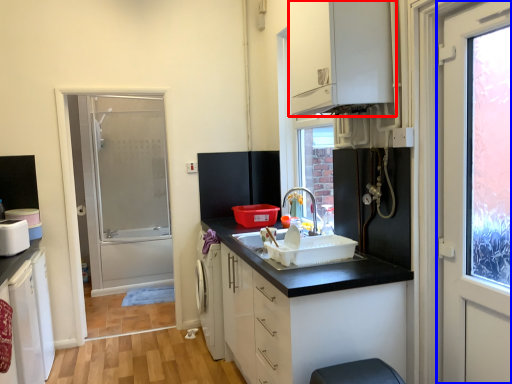
Question: Which object is further to the camera taking this photo, cabinetry (highlighted by a red box) or door (highlighted by a blue box)?

Choices:
 (A) cabinetry
 (B) door

Answer: (A)